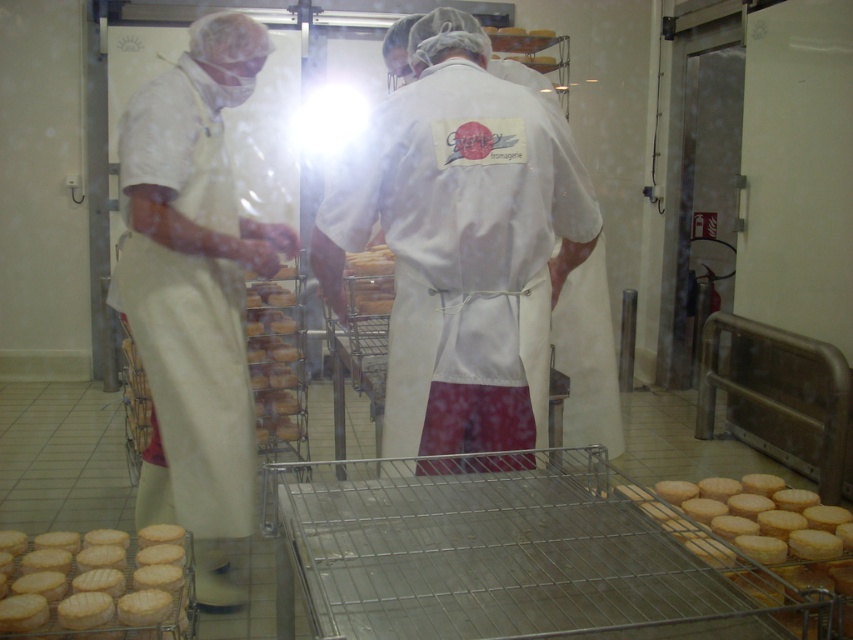
Question: Which point is farther to the camera?

Choices:
 (A) white fabric apron at left
 (B) white fabric coat at center
 (C) yellow matte cheese at lower right

Answer: (A)

Question: Which object is positioned farthest from the yellowish matte cheese at center?

Choices:
 (A) white fabric apron at left
 (B) golden brown cheese at lower left

Answer: (B)

Question: Does white fabric coat at center appear on the left side of golden brown cheese at lower left?

Choices:
 (A) yes
 (B) no

Answer: (B)

Question: Which object is positioned closest to the golden brown cheese at lower left?

Choices:
 (A) yellowish matte cheese at center
 (B) white fabric apron at left
 (C) white fabric coat at center

Answer: (B)

Question: Is white fabric apron at left to the left of golden brown cheese at lower left from the viewer's perspective?

Choices:
 (A) yes
 (B) no

Answer: (B)

Question: Does white fabric coat at center have a lesser width compared to white fabric apron at left?

Choices:
 (A) no
 (B) yes

Answer: (A)